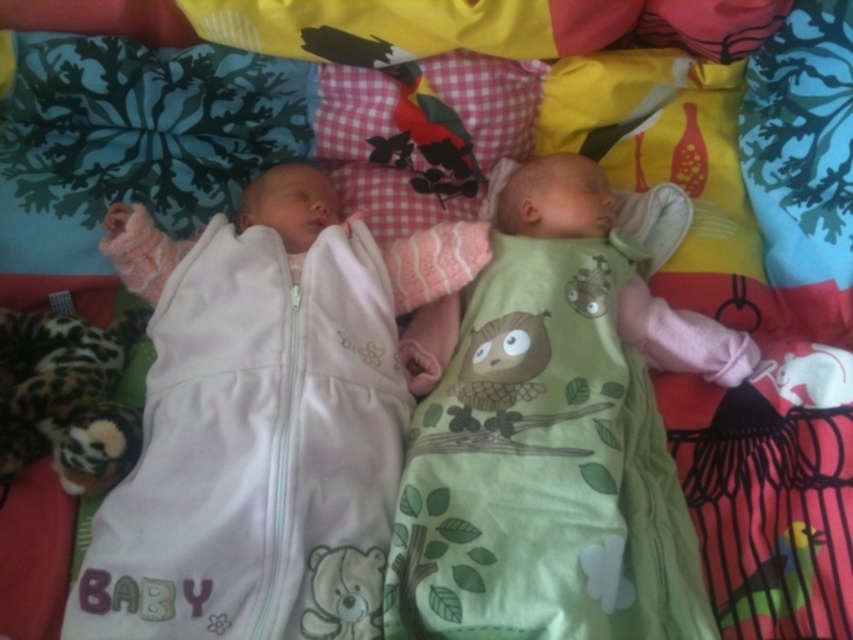
You are a childcare worker observing two babies lying on a bedspread. You need to determine which baby is taller. The babies are the green soft baby at center and the white soft baby sleeping bag at left. Which one is taller?

The green soft baby at center is taller than the white soft baby sleeping bag at left according to the description.

You are a caregiver looking after two babies on a bedspread with nature designs. You need to check if the green soft baby at center is lying on top of the white soft baby sleeping bag at left. Can you confirm this?

The green soft baby at center is positioned over white soft baby sleeping bag at left, so yes, the green soft baby at center is lying on top of the white soft baby sleeping bag at left.